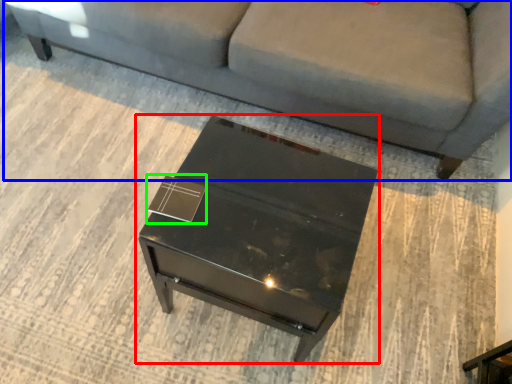
Question: Based on their relative distances, which object is farther from table (highlighted by a red box)? Choose from studio couch (highlighted by a blue box) and square (highlighted by a green box).

Choices:
 (A) studio couch
 (B) square

Answer: (A)